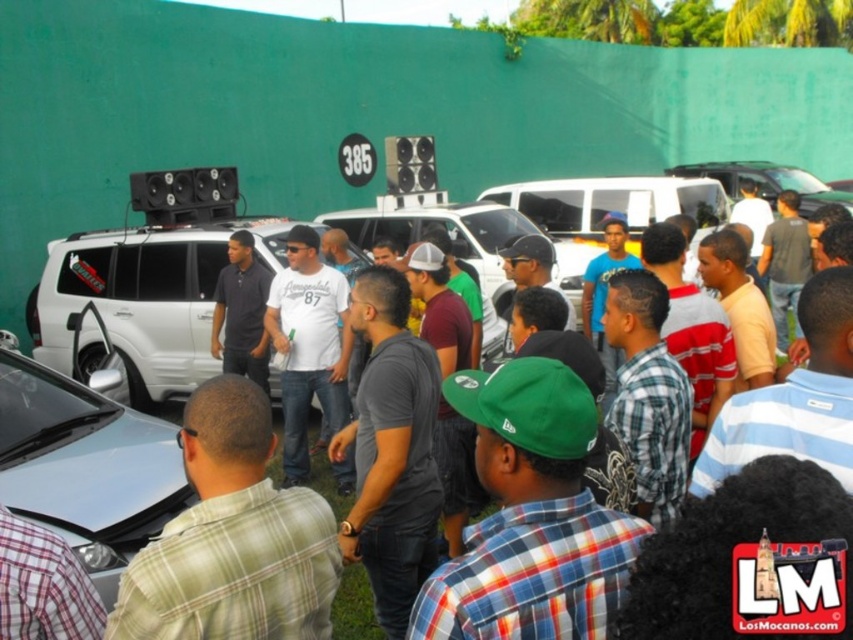
You are at the car meet and want to take a photo of both the satin silver car at lower left and the shiny black car at upper right. Which car should you stand closer to in order to capture both in the same frame?

You should stand closer to the shiny black car at upper right because the satin silver car at lower left is positioned on the left side of it, allowing both cars to be in the same frame when closer to the shiny black car.

Based on the photo, you are at a car meet and want to take a photo of both the white matte suv at upper left and the shiny black car at upper right. Which car should you stand closer to if you want both to be fully visible in your camera frame?

You should stand closer to the shiny black car at upper right because the white matte suv at upper left is positioned on the left side of it, so keeping the shiny black car closer to the center of your frame will help include both vehicles within the camera view.